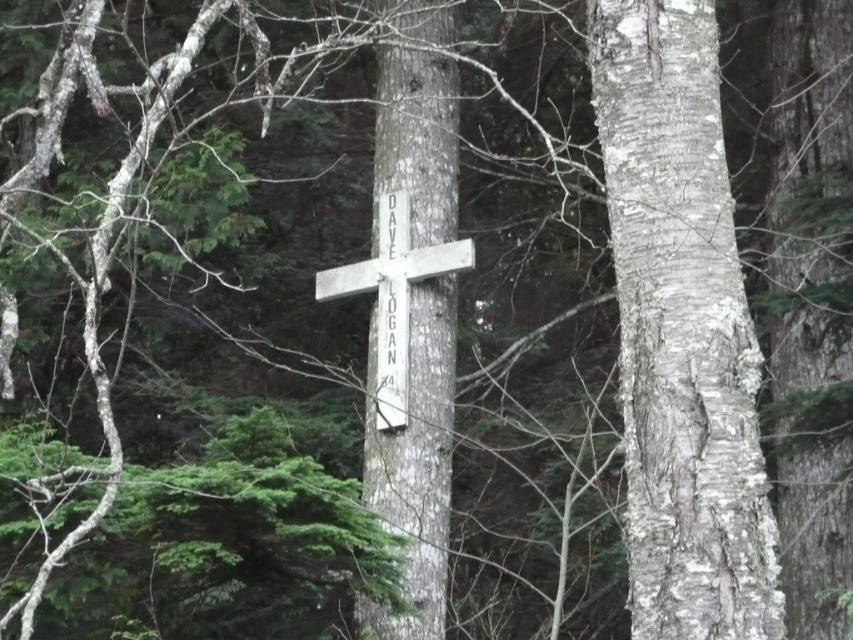
Between smooth bark tree trunk at center and white wood cross at center, which one is positioned lower?

smooth bark tree trunk at center

Is smooth bark tree trunk at center positioned behind white wood cross at center?

→ No.

Identify the location of smooth bark tree trunk at center. The width and height of the screenshot is (853, 640). (682, 330).

Who is lower down, white rough bark cross at center or white wood cross at center?

white rough bark cross at center

Is white rough bark cross at center above white wood cross at center?

No.

In order to click on white rough bark cross at center in this screenshot , I will do `click(415, 465)`.

Looking at this image, between smooth bark tree trunk at center and white rough bark cross at center, which one appears on the left side from the viewer's perspective?

From the viewer's perspective, white rough bark cross at center appears more on the left side.

Where is `smooth bark tree trunk at center`? This screenshot has width=853, height=640. smooth bark tree trunk at center is located at coordinates (682, 330).